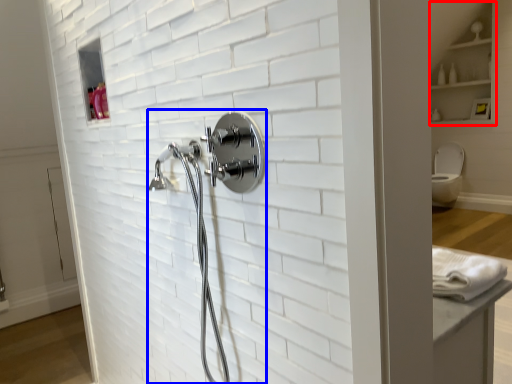
Question: Among these objects, which one is nearest to the camera, cabinet (highlighted by a red box) or shower (highlighted by a blue box)?

Choices:
 (A) cabinet
 (B) shower

Answer: (B)